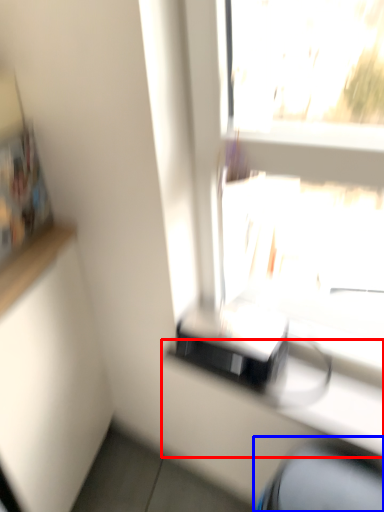
Question: Which point is closer to the camera, counter (highlighted by a red box) or computer chair (highlighted by a blue box)?

Choices:
 (A) counter
 (B) computer chair

Answer: (B)